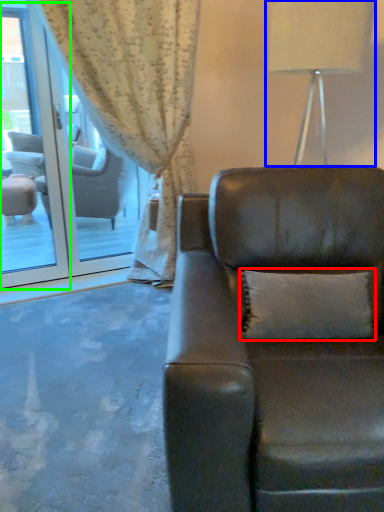
Question: Based on their relative distances, which object is nearer to pillow (highlighted by a red box)? Choose from table lamp (highlighted by a blue box) and screen door (highlighted by a green box).

Choices:
 (A) table lamp
 (B) screen door

Answer: (A)